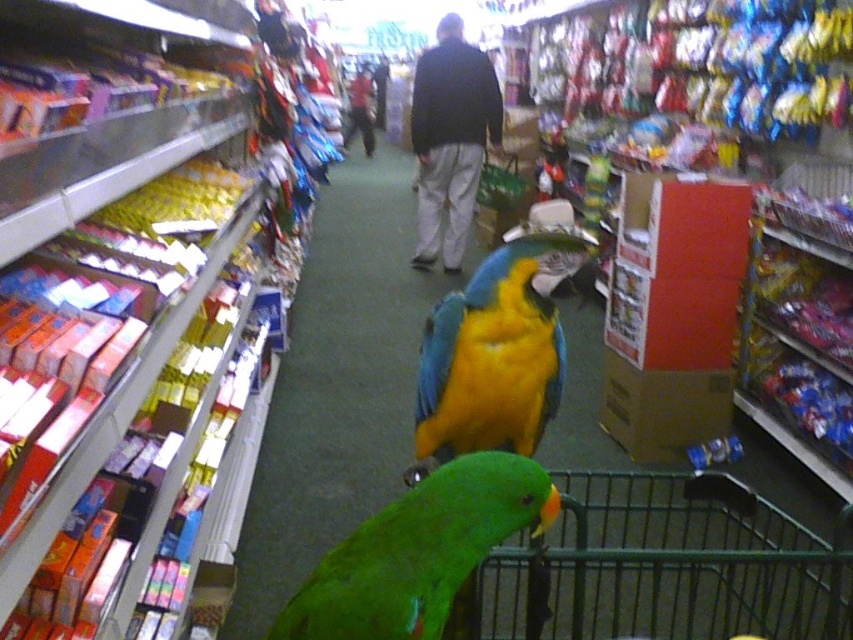
Question: Is green matte parrot at lower center positioned at the back of blue/yellow/glossy parrot at center?

Choices:
 (A) yes
 (B) no

Answer: (B)

Question: Which object is closer to the camera taking this photo?

Choices:
 (A) green matte parrot at lower center
 (B) blue/yellow/glossy parrot at center

Answer: (A)

Question: Does green matte parrot at lower center come in front of blue/yellow/glossy parrot at center?

Choices:
 (A) yes
 (B) no

Answer: (A)

Question: Is green matte parrot at lower center bigger than blue/yellow/glossy parrot at center?

Choices:
 (A) yes
 (B) no

Answer: (B)